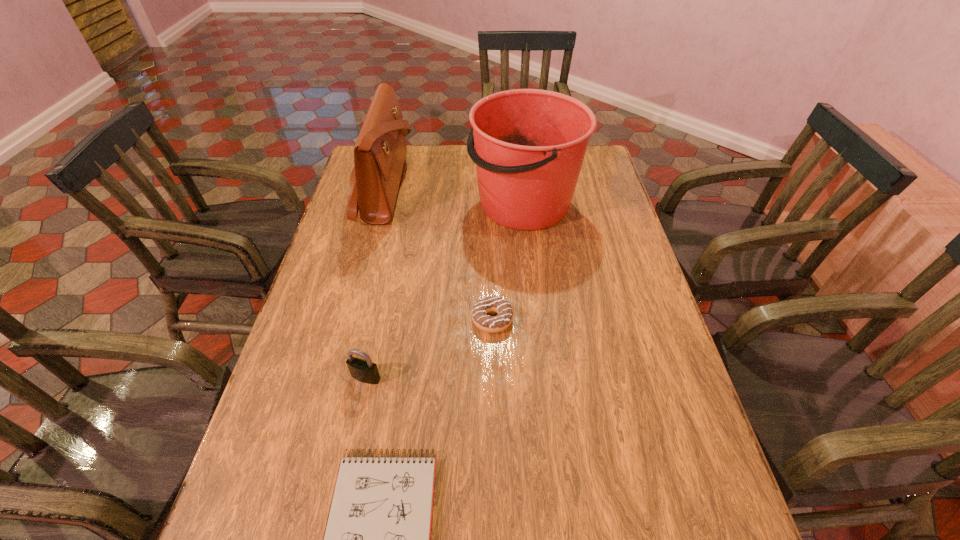
Where is `satchel located at the far edge`? Image resolution: width=960 pixels, height=540 pixels. satchel located at the far edge is located at coordinates [379, 154].

Identify the location of bucket positioned at the far edge. The width and height of the screenshot is (960, 540). (530, 144).

The height and width of the screenshot is (540, 960). What are the coordinates of `satchel at the left edge` in the screenshot? It's located at (379, 154).

This screenshot has width=960, height=540. I want to click on padlock located in the left edge section of the desktop, so click(365, 371).

The image size is (960, 540). Identify the location of object present at the right edge. (530, 144).

Image resolution: width=960 pixels, height=540 pixels. Identify the location of object located in the far left corner section of the desktop. (379, 154).

Find the location of `object located at the far right corner`. object located at the far right corner is located at coordinates (530, 144).

You are a GUI agent. You are given a task and a screenshot of the screen. Output one action in this format:
    pyautogui.click(x=<x>, y=<y>)
    Task: Click on the free spot at the left edge of the desktop
    This screenshot has width=960, height=540.
    Given the screenshot: What is the action you would take?
    pyautogui.click(x=351, y=326)

This screenshot has width=960, height=540. In the image, there is a desktop. In order to click on vacant space at the right edge in this screenshot , I will do `click(639, 456)`.

Locate an element on the screen. This screenshot has width=960, height=540. vacant area that lies between the padlock and the bucket is located at coordinates (444, 291).